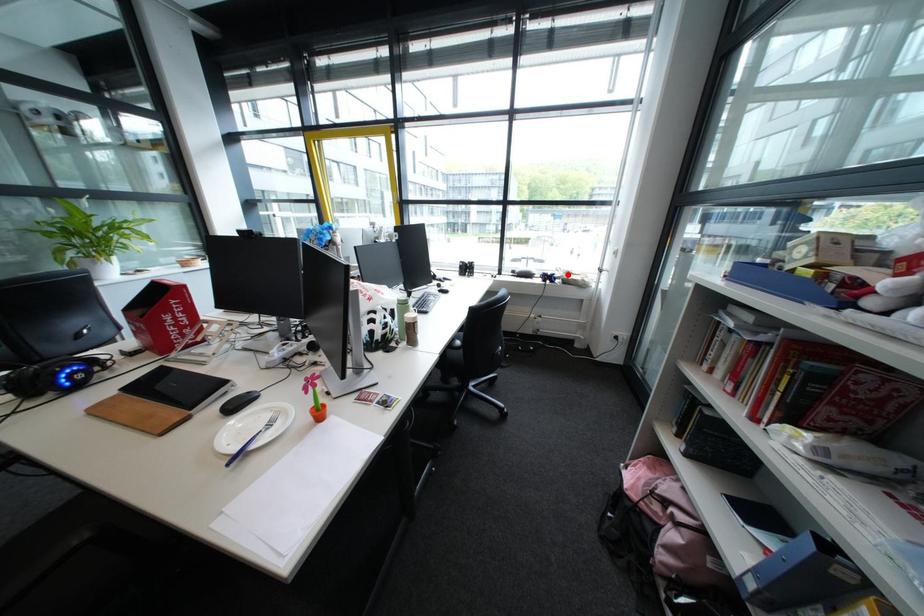
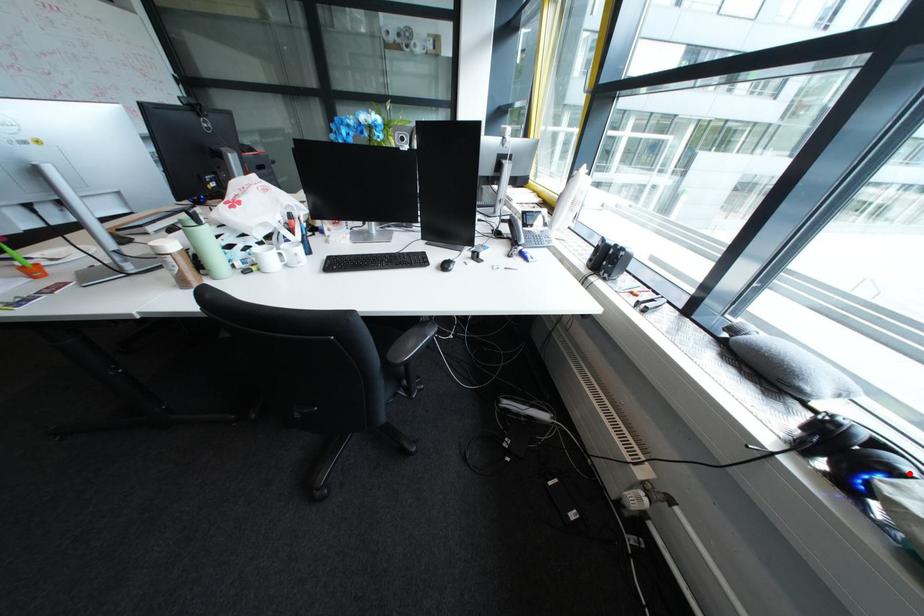
I am providing you with two images of the same scene from different viewpoints. A red point is marked on the first image and another point is marked on the second image. Does the point marked in image1 correspond to the same location as the one in image2?

Yes